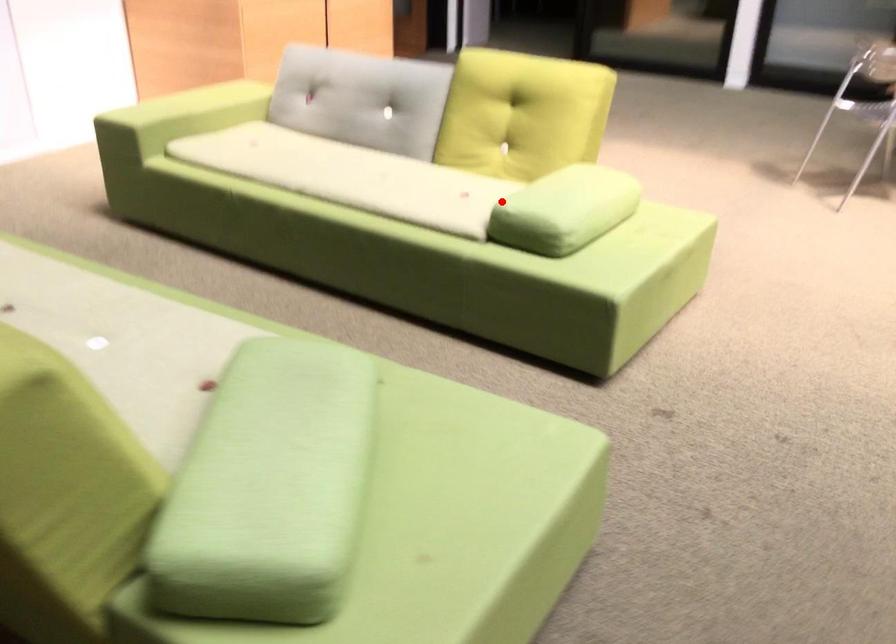
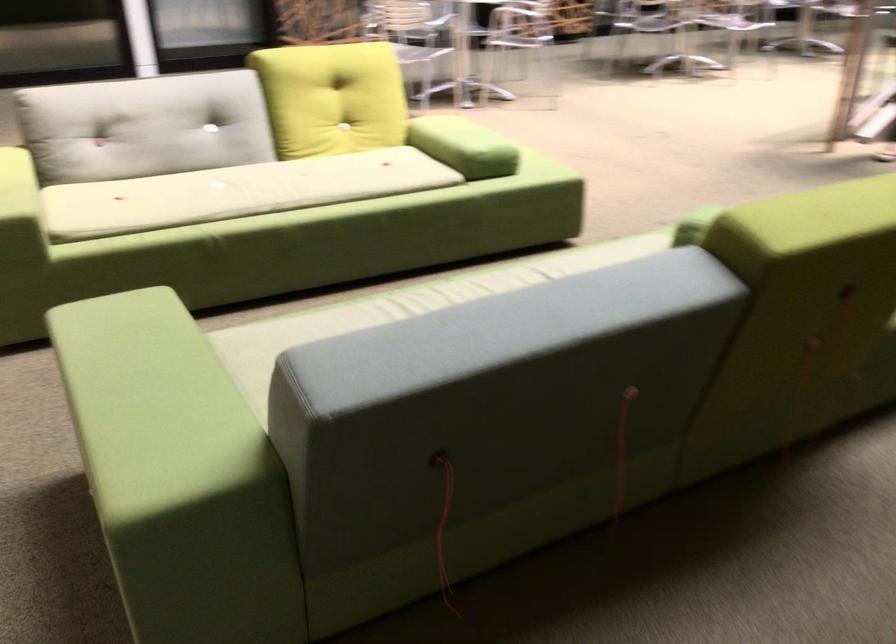
Locate, in the second image, the point that corresponds to the highlighted location in the first image.

(464, 146)